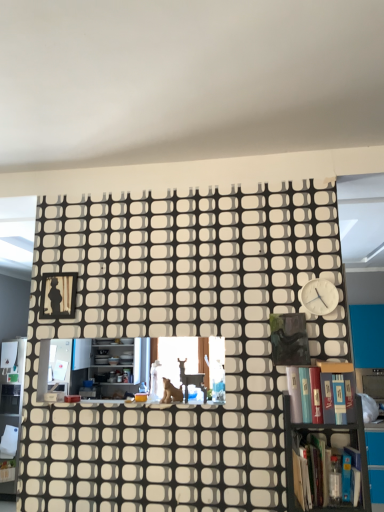
Question: From the image's perspective, is black matte picture frame at upper left positioned above or below metallic gray bookcase at lower right, marked as the first bookcase in a front-to-back arrangement?

Choices:
 (A) below
 (B) above

Answer: (B)

Question: Is black matte picture frame at upper left taller or shorter than metallic gray bookcase at lower right, marked as the first bookcase in a front-to-back arrangement?

Choices:
 (A) tall
 (B) short

Answer: (B)

Question: Estimate the real-world distances between objects in this image. Which object is farther from the black matte picture frame at upper left?

Choices:
 (A) white matte clock at upper right
 (B) hardcover book at right, which is counted as the 2th book, starting from the bottom
 (C) metallic gray bookcase at lower right, marked as the first bookcase in a front-to-back arrangement
 (D) wooden bookcase at center, which ranks as the first bookcase in back-to-front order
 (E) hardcover book at lower right, which appears as the second book when viewed from the top

Answer: (E)

Question: Which is farther from the brown fur cat at center?

Choices:
 (A) metallic gray bookcase at lower right, arranged as the 2th bookcase when viewed from the back
 (B) wooden bookcase at center, which is counted as the 2th bookcase, starting from the front
 (C) white matte clock at upper right
 (D) hardcover book at lower right, which appears as the second book when viewed from the top
 (E) hardcover book at right, which is counted as the 2th book, starting from the bottom

Answer: (C)